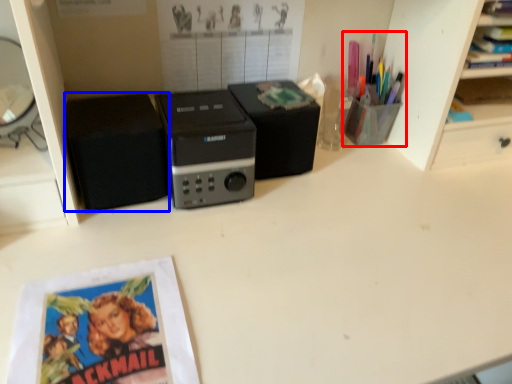
Question: Which point is closer to the camera, stationery (highlighted by a red box) or speaker (highlighted by a blue box)?

Choices:
 (A) stationery
 (B) speaker

Answer: (B)